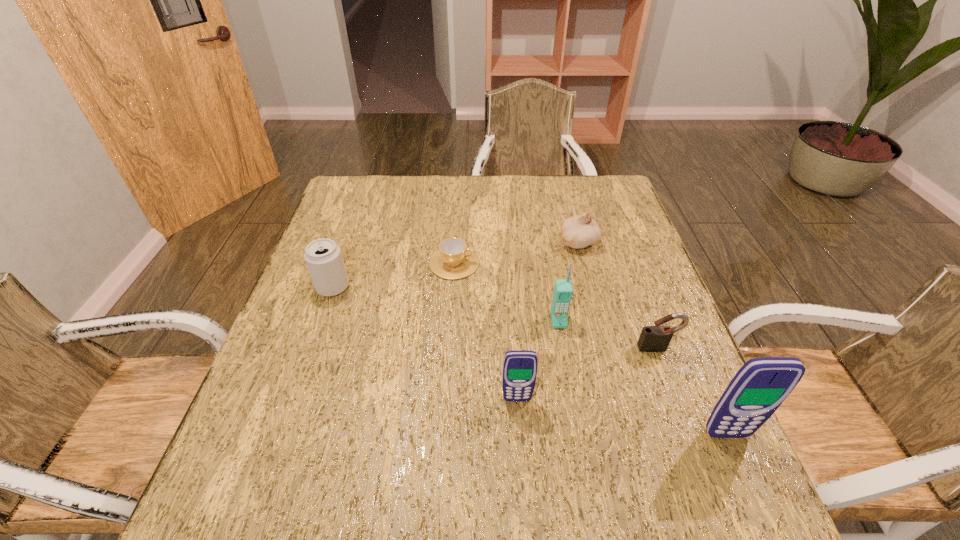
Locate an element on the screen. vacant spot to place a cellular telephone on the left is located at coordinates (331, 369).